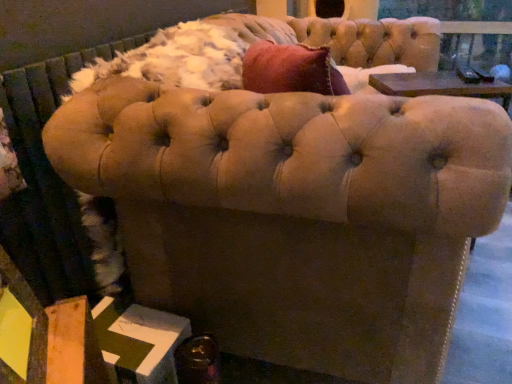
What do you see at coordinates (197, 360) in the screenshot? The image size is (512, 384). I see `shiny metallic bottle at lower left` at bounding box center [197, 360].

This screenshot has width=512, height=384. What are the coordinates of `shiny metallic bottle at lower left` in the screenshot? It's located at (197, 360).

Describe the element at coordinates (295, 214) in the screenshot. I see `velvet beige sofa at center` at that location.

Locate an element on the screen. The height and width of the screenshot is (384, 512). velvet beige sofa at center is located at coordinates click(295, 214).

What are the coordinates of `shiny metallic bottle at lower left` in the screenshot? It's located at coord(197,360).

Which object is positioned more to the left, shiny metallic bottle at lower left or velvet beige sofa at center?

shiny metallic bottle at lower left is more to the left.

Is shiny metallic bottle at lower left behind velvet beige sofa at center?

Yes, shiny metallic bottle at lower left is further from the camera.

Is point (215, 377) closer or farther from the camera than point (270, 346)?

Point (215, 377) appears to be closer to the viewer than point (270, 346).

Looking at this image, from the image's perspective, who appears lower, shiny metallic bottle at lower left or velvet beige sofa at center?

shiny metallic bottle at lower left.

From a real-world perspective, is shiny metallic bottle at lower left positioned above or below velvet beige sofa at center?

shiny metallic bottle at lower left is situated lower than velvet beige sofa at center in the real world.

Which object is wider, shiny metallic bottle at lower left or velvet beige sofa at center?

velvet beige sofa at center is wider.

From the picture: Considering the sizes of objects shiny metallic bottle at lower left and velvet beige sofa at center in the image provided, who is taller, shiny metallic bottle at lower left or velvet beige sofa at center?

velvet beige sofa at center is taller.

Considering the sizes of objects shiny metallic bottle at lower left and velvet beige sofa at center in the image provided, who is smaller, shiny metallic bottle at lower left or velvet beige sofa at center?

shiny metallic bottle at lower left.

Is shiny metallic bottle at lower left not inside velvet beige sofa at center?

Yes, shiny metallic bottle at lower left is outside of velvet beige sofa at center.

Is shiny metallic bottle at lower left placed right next to velvet beige sofa at center?

No.

Could you tell me if shiny metallic bottle at lower left is facing velvet beige sofa at center?

Yes, shiny metallic bottle at lower left faces towards velvet beige sofa at center.

Locate an element on the screen. bottle below the velvet beige sofa at center (from a real-world perspective) is located at coordinates (197, 360).

Which is more to the right, velvet beige sofa at center or shiny metallic bottle at lower left?

velvet beige sofa at center is more to the right.

Does velvet beige sofa at center come in front of shiny metallic bottle at lower left?

Yes, velvet beige sofa at center is closer to the viewer.

Is point (432, 373) in front of point (179, 374)?

No, (432, 373) is further to viewer.

From the image's perspective, is velvet beige sofa at center on top of shiny metallic bottle at lower left?

A: Yes, from the image's perspective, velvet beige sofa at center is on top of shiny metallic bottle at lower left.

From a real-world perspective, does velvet beige sofa at center stand above shiny metallic bottle at lower left?

Indeed, from a real-world perspective, velvet beige sofa at center stands above shiny metallic bottle at lower left.

Can you confirm if velvet beige sofa at center is thinner than shiny metallic bottle at lower left?

In fact, velvet beige sofa at center might be wider than shiny metallic bottle at lower left.

Does velvet beige sofa at center have a lesser height compared to shiny metallic bottle at lower left?

In fact, velvet beige sofa at center may be taller than shiny metallic bottle at lower left.

Can you confirm if velvet beige sofa at center is smaller than shiny metallic bottle at lower left?

No, velvet beige sofa at center is not smaller than shiny metallic bottle at lower left.

Would you say velvet beige sofa at center contains shiny metallic bottle at lower left?

No, shiny metallic bottle at lower left is not a part of velvet beige sofa at center.

Is velvet beige sofa at center far away from shiny metallic bottle at lower left?

That's not correct — velvet beige sofa at center is a little close to shiny metallic bottle at lower left.

Could you tell me if velvet beige sofa at center is turned towards shiny metallic bottle at lower left?

No, velvet beige sofa at center is not aimed at shiny metallic bottle at lower left.

How many degrees apart are the facing directions of velvet beige sofa at center and shiny metallic bottle at lower left?

They differ by 28.4 degrees in their facing directions.

How far apart are velvet beige sofa at center and shiny metallic bottle at lower left?

The distance of velvet beige sofa at center from shiny metallic bottle at lower left is 13.41 inches.

Where is `bottle behind the velvet beige sofa at center`? The image size is (512, 384). bottle behind the velvet beige sofa at center is located at coordinates (197, 360).

The height and width of the screenshot is (384, 512). In the image, there is a velvet beige sofa at center. Identify the location of bottle below it (from a real-world perspective). (197, 360).

The height and width of the screenshot is (384, 512). Identify the location of bottle below the velvet beige sofa at center (from the image's perspective). point(197,360).